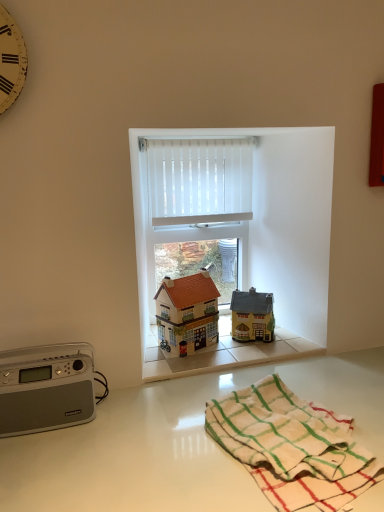
At what (x,y) coordinates should I click in order to perform the action: click on vacant space to the right of matte yellow house at center, the 1th toy when ordered from right to left. Please return your answer as a coordinate pair (x, y). Looking at the image, I should click on (290, 339).